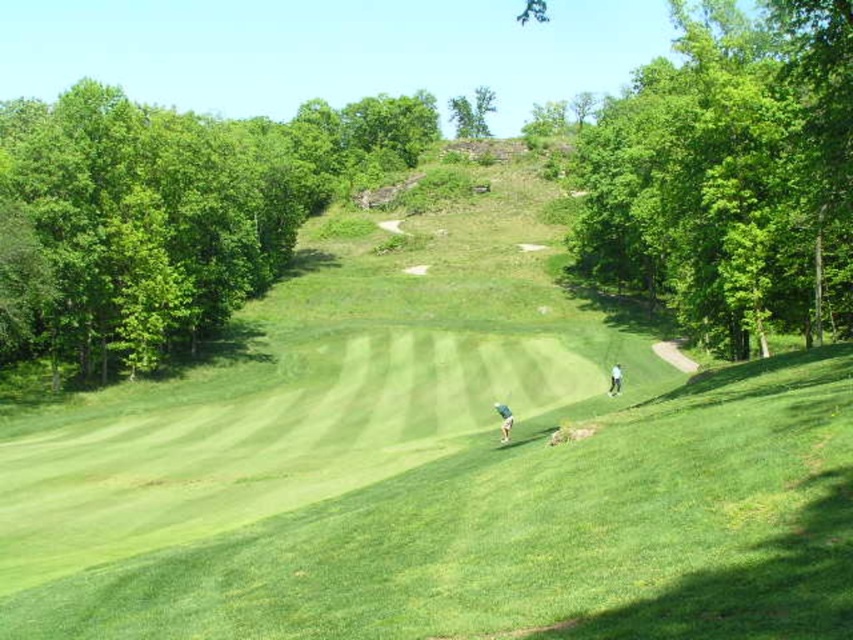
How far apart are green leafy trees at left and green leafy tree at upper right?

green leafy trees at left is 58.16 meters from green leafy tree at upper right.

Is point (236, 273) positioned before point (788, 205)?

No, (236, 273) is further to viewer.

At what (x,y) coordinates should I click in order to perform the action: click on green leafy trees at left. Please return your answer as a coordinate pair (x, y). This screenshot has height=640, width=853. Looking at the image, I should click on (165, 220).

Is green leafy tree at upper center taller than white fabric person at lower right?

Indeed, green leafy tree at upper center has a greater height compared to white fabric person at lower right.

Is green leafy tree at upper center wider than white fabric person at lower right?

Correct, the width of green leafy tree at upper center exceeds that of white fabric person at lower right.

Who is more distant from viewer, (460, 124) or (619, 376)?

The point (460, 124) is more distant.

This screenshot has height=640, width=853. I want to click on green leafy tree at upper center, so click(473, 113).

Is green leafy tree at upper right below light brown leather golf club at center?

No, green leafy tree at upper right is not below light brown leather golf club at center.

Is green leafy tree at upper right wider than light brown leather golf club at center?

Yes, green leafy tree at upper right is wider than light brown leather golf club at center.

What do you see at coordinates (730, 173) in the screenshot?
I see `green leafy tree at upper right` at bounding box center [730, 173].

This screenshot has height=640, width=853. I want to click on green leafy tree at upper right, so click(x=730, y=173).